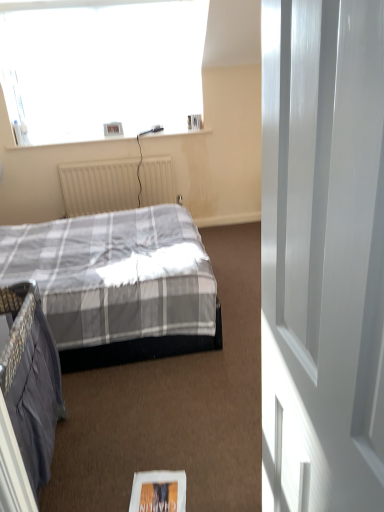
The height and width of the screenshot is (512, 384). I want to click on free space above beige textured radiator at center (from a real-world perspective), so click(x=114, y=158).